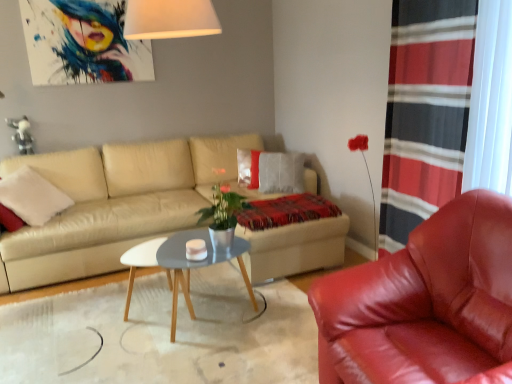
At what (x,y) coordinates should I click in order to perform the action: click on free space on the front side of gray wooden coffee table at center. Please return your answer as a coordinate pair (x, y). This screenshot has width=512, height=384. Looking at the image, I should click on (193, 361).